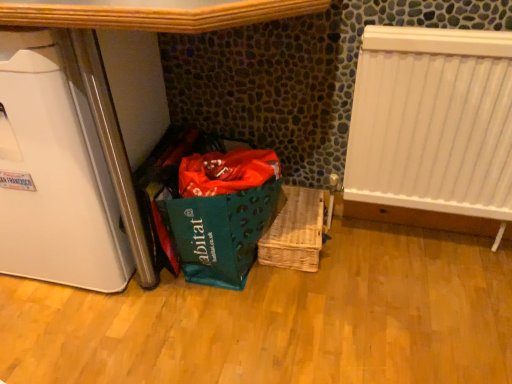
The height and width of the screenshot is (384, 512). In order to click on vacant space in front of white glossy refrigerator at left in this screenshot , I will do `click(81, 333)`.